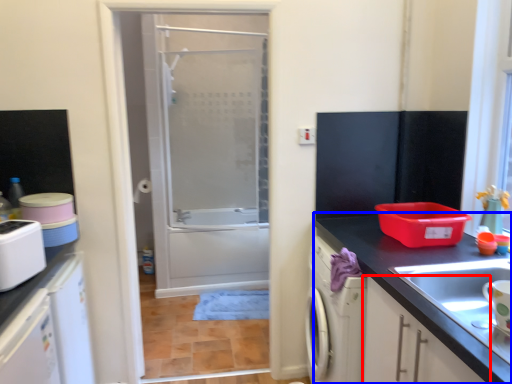
Question: Which object is further to the camera taking this photo, cabinetry (highlighted by a red box) or countertop (highlighted by a blue box)?

Choices:
 (A) cabinetry
 (B) countertop

Answer: (B)